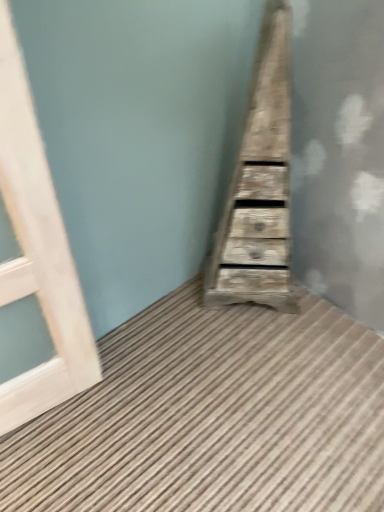
The image size is (384, 512). Find the location of `vacant space situated on the left part of distressed wood dresser at center`. vacant space situated on the left part of distressed wood dresser at center is located at coordinates (176, 318).